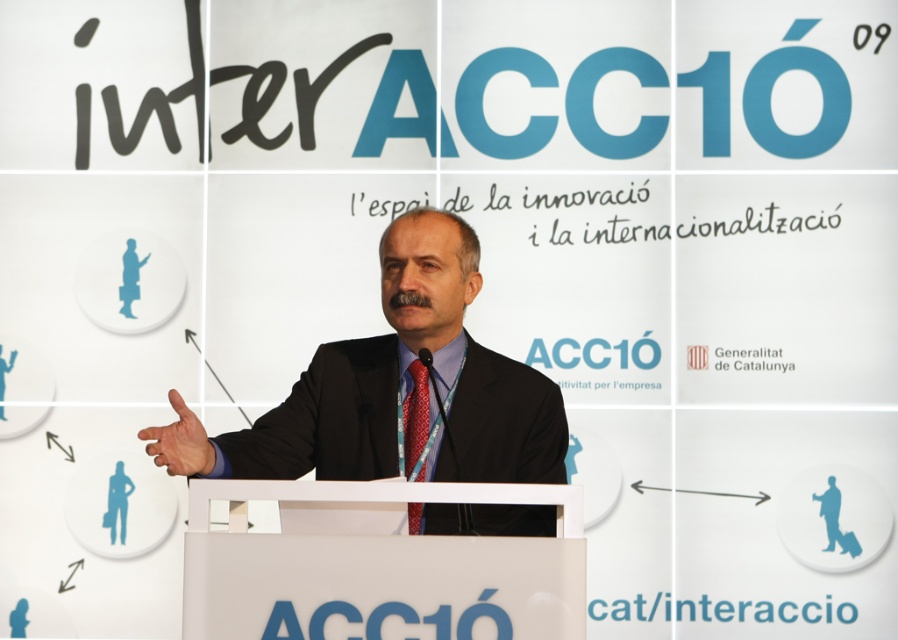
Who is positioned more to the right, black suit at center or red silk tie at center?

From the viewer's perspective, red silk tie at center appears more on the right side.

Does black suit at center appear over red silk tie at center?

Yes, black suit at center is above red silk tie at center.

Identify the location of black suit at center. (395, 388).

Locate an element on the screen. The width and height of the screenshot is (898, 640). black suit at center is located at coordinates (395, 388).